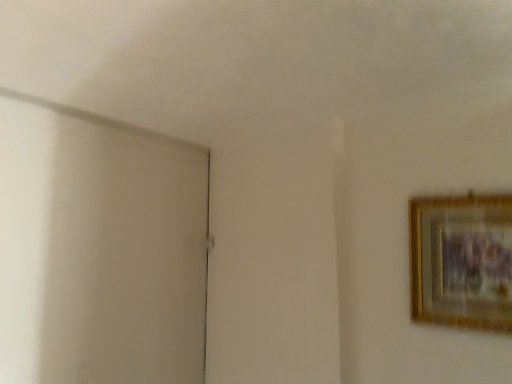
What are the coordinates of `gold-framed picture at upper right` in the screenshot? It's located at (461, 261).

What do you see at coordinates (461, 261) in the screenshot? I see `gold-framed picture at upper right` at bounding box center [461, 261].

Find the location of a particular element. gold-framed picture at upper right is located at coordinates (461, 261).